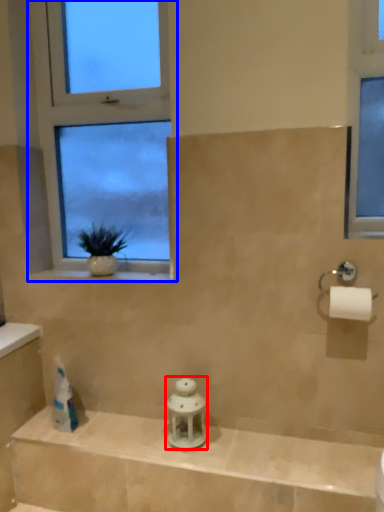
Question: Among these objects, which one is nearest to the camera, toiletry (highlighted by a red box) or window (highlighted by a blue box)?

Choices:
 (A) toiletry
 (B) window

Answer: (A)